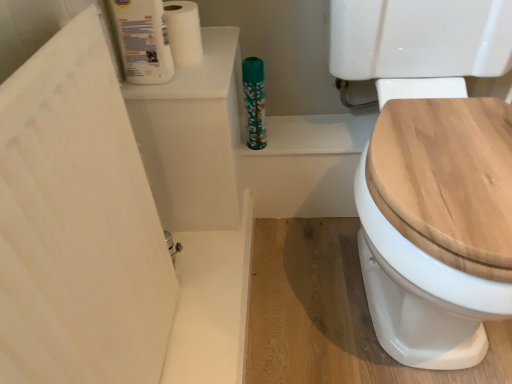
The height and width of the screenshot is (384, 512). I want to click on free spot to the right of teal floral-patterned bottle at upper center, so click(312, 134).